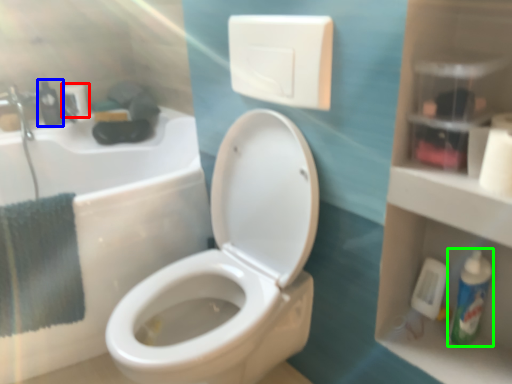
Question: Which is farther away from toilet paper (highlighted by a red box)? mouthwash (highlighted by a blue box) or mouthwash (highlighted by a green box)?

Choices:
 (A) mouthwash
 (B) mouthwash

Answer: (B)